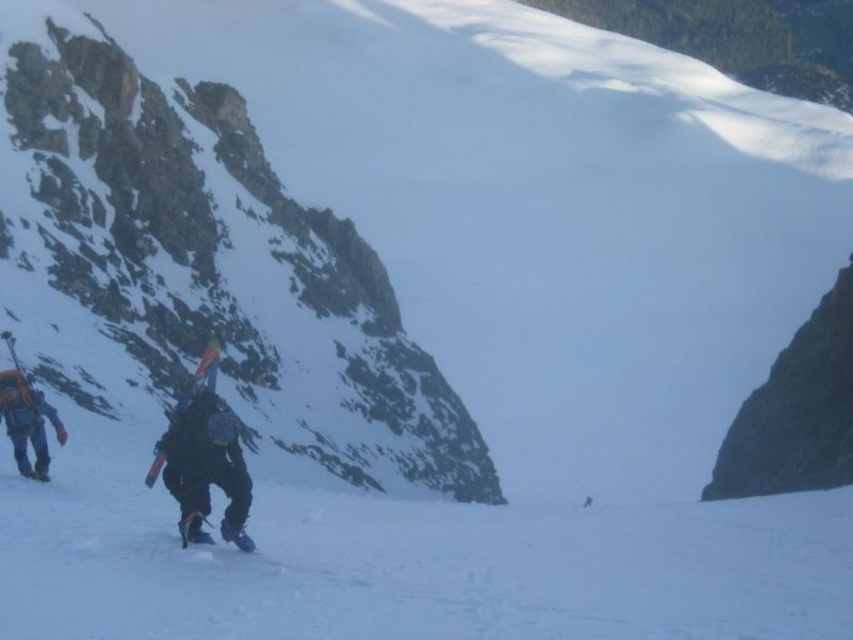
You are navigating a snowy mountain path and need to locate the orange fabric backpack at left. According to the map coordinates provided, where would you find it?

The orange fabric backpack at left is located at the 2D coordinates point (27, 422).

You are planning to send a rescue drone to the black fabric backpack at lower left. The drone can only fly 25 meters before needing to recharge. Can the drone reach the backpack from your current position?

The individuals are 31.09 meters apart, which is beyond the drone flight range of 25 meters. The drone cannot reach the black fabric backpack at lower left.

What is located at the coordinate point (27, 422) in the snowy mountain scene?

The orange fabric backpack at left is located at the coordinate point (27, 422) in the snowy mountain scene.